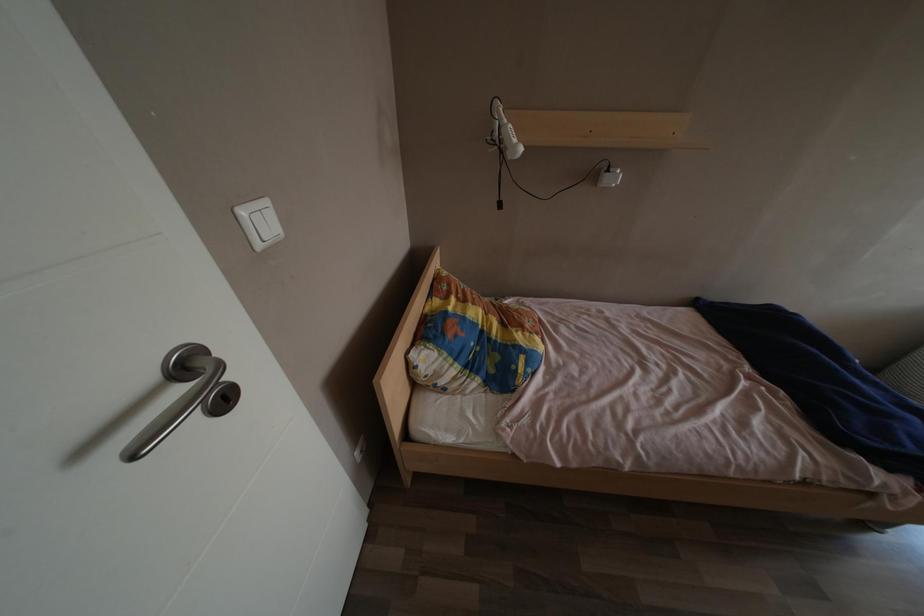
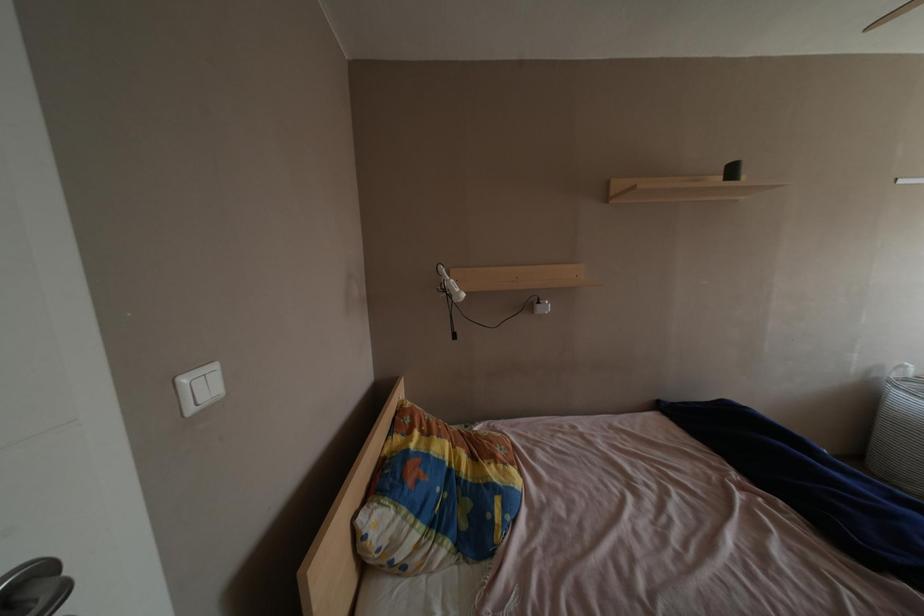
In a continuous first-person perspective shot, in which direction is the camera moving?

The cameraman walked toward right, backward.